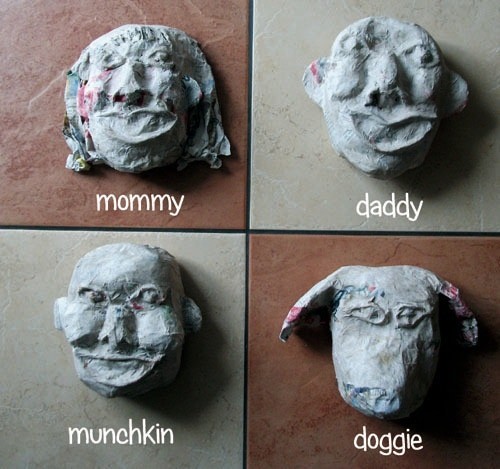
At what (x,y) coordinates should I click in order to perform the action: click on lines in brown tile. Please return your answer as a coordinate pair (x, y). Looking at the image, I should click on (34, 97), (222, 17).